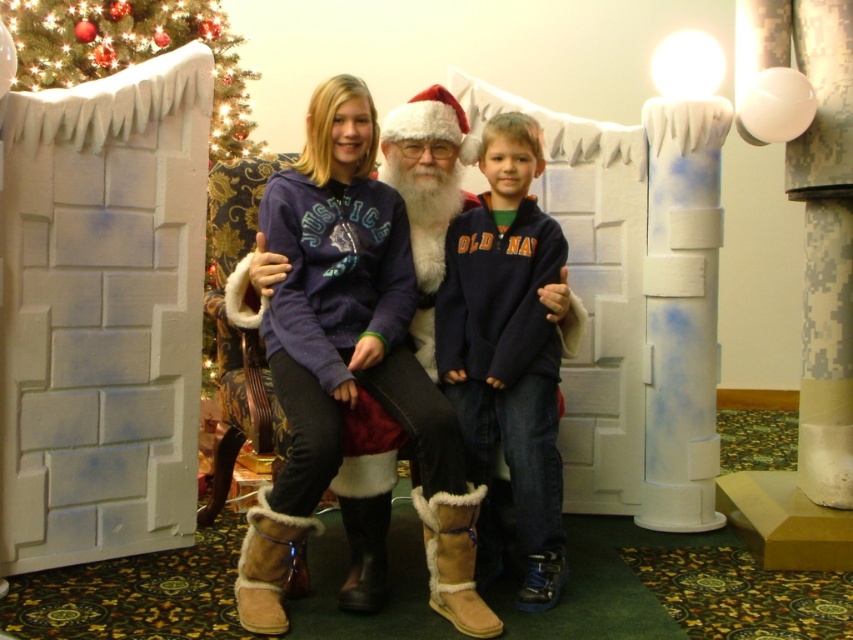
Can you confirm if brown suede boots at center is taller than white painted wood pillar at right?

Incorrect, brown suede boots at center's height is not larger of white painted wood pillar at right's.

Describe the element at coordinates (363, 348) in the screenshot. I see `brown suede boots at center` at that location.

Locate an element on the screen. The image size is (853, 640). brown suede boots at center is located at coordinates (363, 348).

Is brown suede boots at center closer to the viewer compared to green artificial christmas tree at upper left?

Yes, it is.

Where is `brown suede boots at center`? The image size is (853, 640). brown suede boots at center is located at coordinates (363, 348).

Does brown suede boots at center come in front of navy fleece sweatshirt at center?

Yes, brown suede boots at center is closer to the viewer.

Can you confirm if brown suede boots at center is shorter than navy fleece sweatshirt at center?

No.

I want to click on brown suede boots at center, so click(363, 348).

Identify the location of brown suede boots at center. Image resolution: width=853 pixels, height=640 pixels. (363, 348).